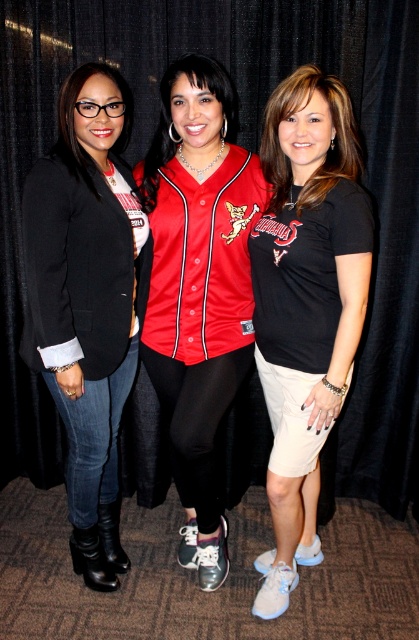
In the scene shown: You are a fashion designer observing the three women at an event. You need to determine which garment has a larger size between the matte black blazer at left and the red matte baseball jersey at center. Which one is bigger?

The red matte baseball jersey at center is larger than the matte black blazer at left.